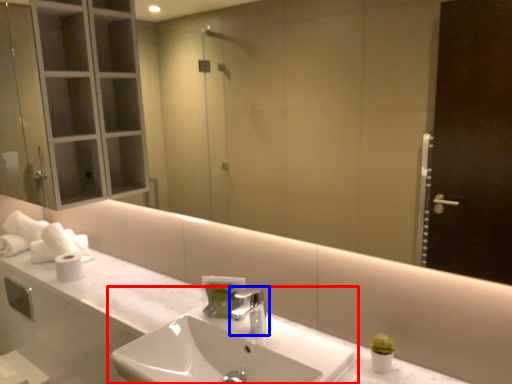
Question: Which point is closer to the camera, sink (highlighted by a red box) or tap (highlighted by a blue box)?

Choices:
 (A) sink
 (B) tap

Answer: (A)